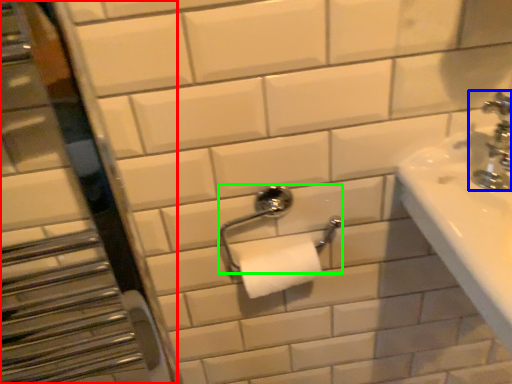
Question: Estimate the real-world distances between objects in this image. Which object is closer to mirror (highlighted by a red box), tap (highlighted by a blue box) or towel bar (highlighted by a green box)?

Choices:
 (A) tap
 (B) towel bar

Answer: (B)